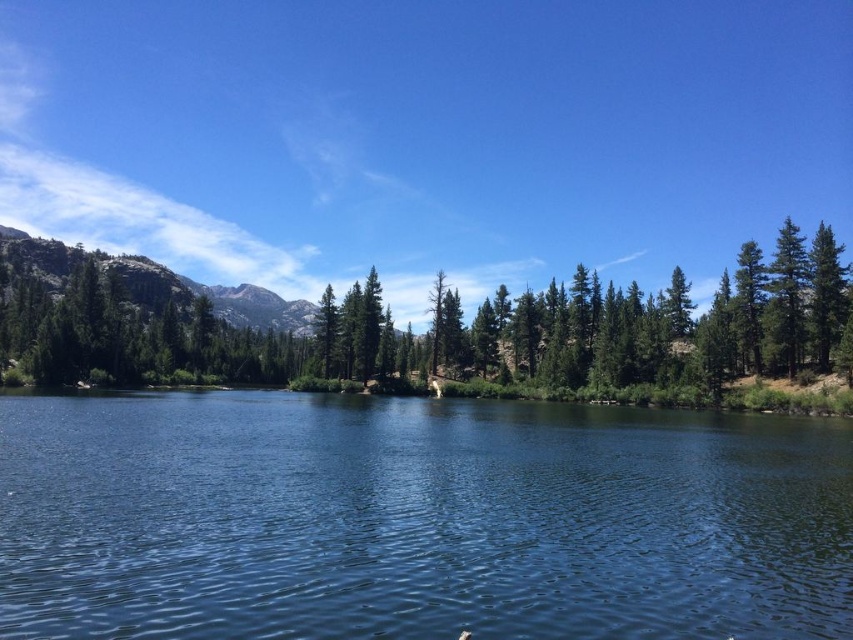
Question: Is clear blue water at center to the left of rugged granite mountain at left from the viewer's perspective?

Choices:
 (A) yes
 (B) no

Answer: (B)

Question: Does clear blue water at center appear on the right side of rugged granite mountain at left?

Choices:
 (A) no
 (B) yes

Answer: (B)

Question: Which object is farther from the camera taking this photo?

Choices:
 (A) clear blue water at center
 (B) rugged granite mountain at left

Answer: (B)

Question: Which point appears farthest from the camera in this image?

Choices:
 (A) (265, 596)
 (B) (138, 301)

Answer: (B)

Question: Which of the following is the closest to the observer?

Choices:
 (A) (141, 276)
 (B) (747, 426)

Answer: (B)

Question: Is clear blue water at center closer to camera compared to rugged granite mountain at left?

Choices:
 (A) no
 (B) yes

Answer: (B)